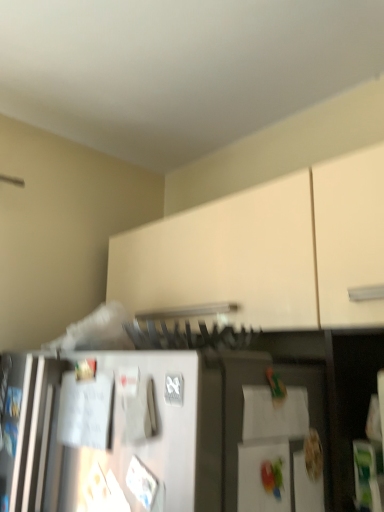
This screenshot has width=384, height=512. Describe the element at coordinates (162, 433) in the screenshot. I see `white matte refrigerator at lower left` at that location.

At what (x,y) coordinates should I click in order to perform the action: click on white matte refrigerator at lower left. Please return your answer as a coordinate pair (x, y). Looking at the image, I should click on (162, 433).

In order to face white matte refrigerator at lower left, should I rotate leftwards or rightwards?

You should look left and rotate roughly 17.650 degrees.

You are a GUI agent. You are given a task and a screenshot of the screen. Output one action in this format:
    pyautogui.click(x=<x>, y=<y>)
    Task: Click on the white matte refrigerator at lower left
    Image resolution: width=384 pixels, height=512 pixels.
    Given the screenshot: What is the action you would take?
    pyautogui.click(x=162, y=433)